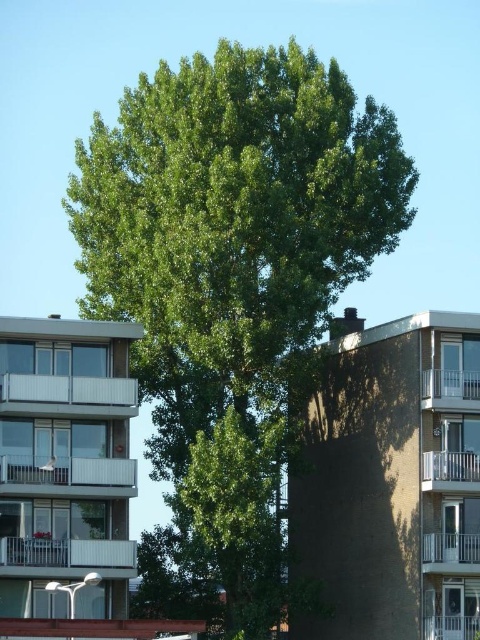
You are a window cleaner standing on the ground looking at the green leafy tree at center and the white glossy balcony at lower left. Which object is taller?

The green leafy tree at center is much taller than the white glossy balcony at lower left.

What are the coordinates of the green leafy tree at center?

The coordinates of the green leafy tree at center are at point (231, 289).

You are standing at the point marked as point [68,396] in the image. Which object are you currently on?

The point [68,396] is on the white glass balcony at left, so you are currently on the white glass balcony at left.